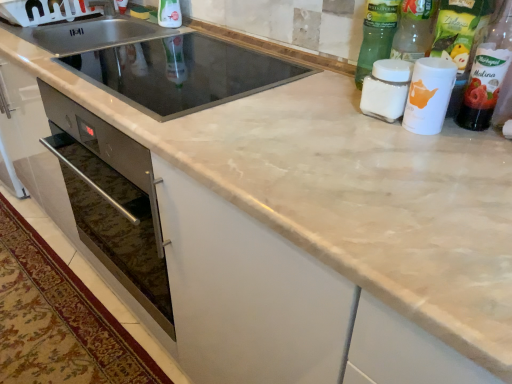
Identify the location of free space in front of translucent plastic bottle at upper right, placed as the sixth bottle when sorted from left to right. (472, 153).